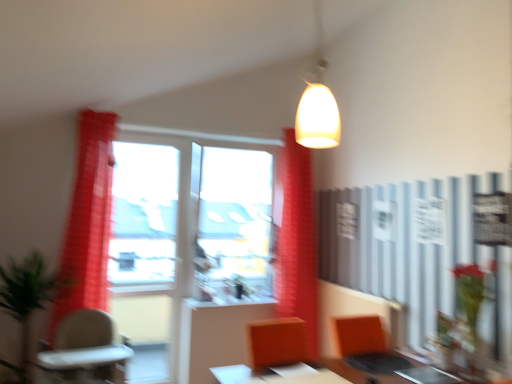
Question: Is metallic silver table at center, which is counted as the second table, starting from the left, situated inside matte white pendant light at upper center or outside?

Choices:
 (A) outside
 (B) inside

Answer: (A)

Question: From a real-world perspective, relative to matte white pendant light at upper center, is metallic silver table at center, acting as the first table starting from the right, vertically above or below?

Choices:
 (A) below
 (B) above

Answer: (A)

Question: Which object is the closest to the transparent glass window at center, which is the second window screen from left to right?

Choices:
 (A) orange fabric armchair at lower right
 (B) matte white pendant light at upper center
 (C) green matte plant at center, which is the 2th plant in left-to-right order
 (D) red sheer curtain at left, marked as the 1th curtain in a left-to-right arrangement
 (E) metallic silver table at center, acting as the first table starting from the right

Answer: (C)

Question: Which object is positioned farthest from the transparent glass window at center, which is the second window screen from left to right?

Choices:
 (A) green leafy plant at left, which appears as the second plant when viewed from the back
 (B) red sheer curtain at left, which is the second curtain from back to front
 (C) transparent glass window at left, which is the second window screen from right to left
 (D) metallic silver table at center, which is counted as the second table, starting from the left
 (E) red fabric curtain at center, the first curtain viewed from the back

Answer: (D)